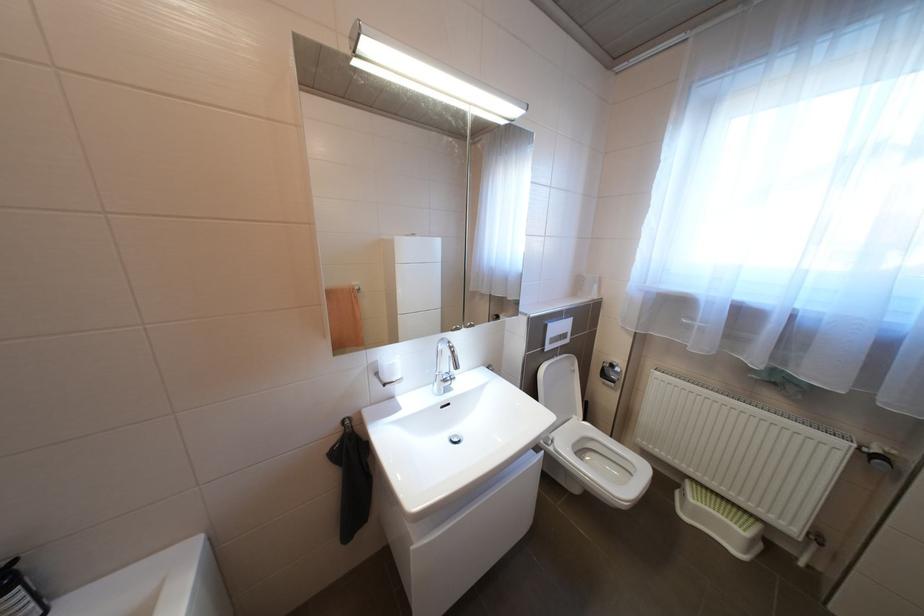
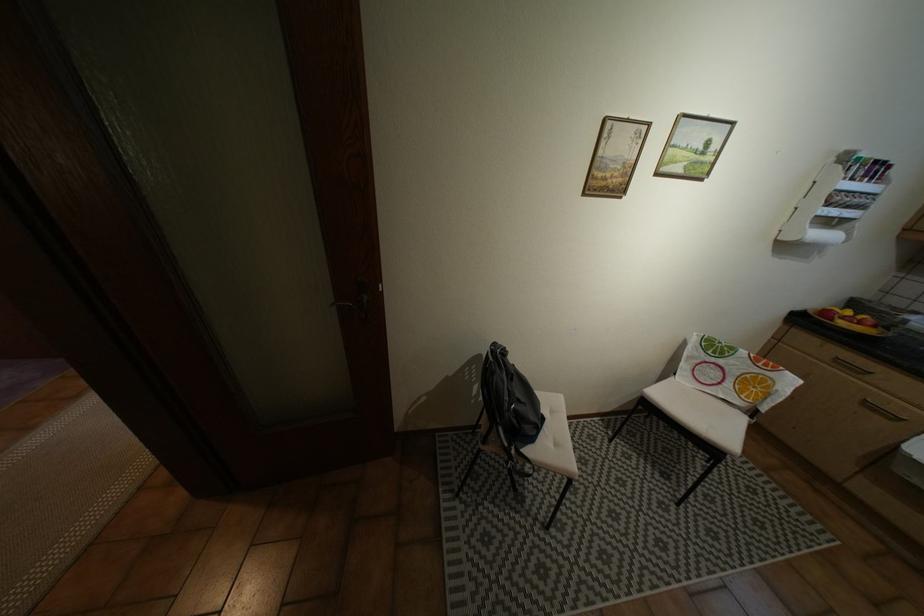
Question: In a continuous first-person perspective shot, in which direction is the camera moving?

Choices:
 (A) Left
 (B) Right
 (C) Forward
 (D) Backward

Answer: (D)